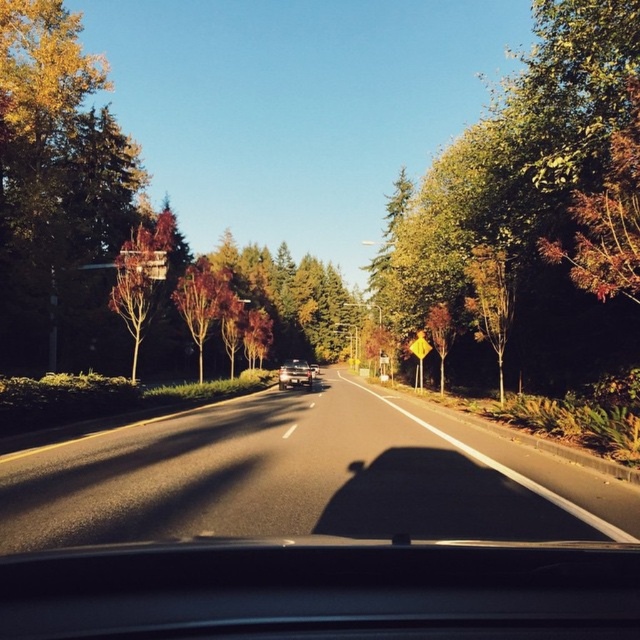
You are driving and want to check the road ahead. Where should you look through the transparent glass windshield at center to see the asphalt road at center?

The asphalt road at center is below the transparent glass windshield at center, so you should look downward through the transparent glass windshield at center to see the asphalt road at center.

You are a driver navigating a scenic route and want to ensure your vehicle stays on the asphalt road at center. Given the coordinates provided, can you confirm if the point at (x=301, y=477) is on the asphalt road at center?

Yes, the point at (x=301, y=477) is on the asphalt road at center as specified in the description.